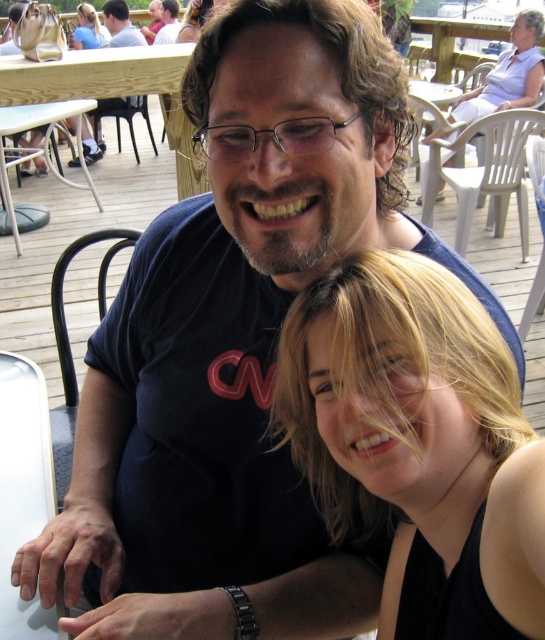
Question: Can you confirm if blue cotton shirt at upper center is bigger than blonde hair at upper center?

Choices:
 (A) no
 (B) yes

Answer: (B)

Question: Is blonde hair at lower right further to the viewer compared to white plastic table at lower left?

Choices:
 (A) yes
 (B) no

Answer: (B)

Question: Which of the following is the farthest from the observer?

Choices:
 (A) (10, 67)
 (B) (473, 120)

Answer: (B)

Question: Which point appears closest to the camera in this image?

Choices:
 (A) (93, 33)
 (B) (378, 474)

Answer: (B)

Question: Considering the real-world distances, which object is closest to the blue cotton shirt at upper center?

Choices:
 (A) blonde hair at upper center
 (B) blonde hair at upper left

Answer: (A)

Question: Is wooden picnic table at upper left to the right of blonde hair at upper center from the viewer's perspective?

Choices:
 (A) no
 (B) yes

Answer: (A)